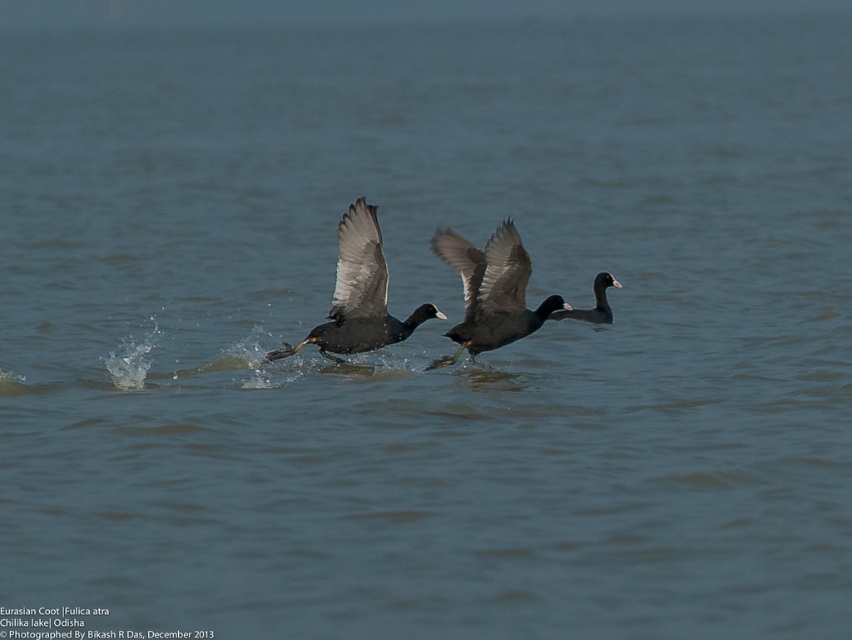
Is dark gray matte eurasian coot at center taller than black glossy eurasian coot at center?

Yes.

Is dark gray matte eurasian coot at center to the right of black glossy eurasian coot at center from the viewer's perspective?

No, dark gray matte eurasian coot at center is not to the right of black glossy eurasian coot at center.

Image resolution: width=852 pixels, height=640 pixels. What do you see at coordinates (491, 291) in the screenshot?
I see `dark gray matte eurasian coot at center` at bounding box center [491, 291].

Find the location of a particular element. dark gray matte eurasian coot at center is located at coordinates (491, 291).

Does dark gray feathers at center have a lesser width compared to black glossy eurasian coot at center?

In fact, dark gray feathers at center might be wider than black glossy eurasian coot at center.

Which is more to the right, dark gray feathers at center or black glossy eurasian coot at center?

black glossy eurasian coot at center

Which is in front, point (350, 298) or point (599, 307)?

Point (350, 298) is in front.

Image resolution: width=852 pixels, height=640 pixels. I want to click on dark gray feathers at center, so click(360, 294).

Can you confirm if dark gray matte eurasian coot at center is thinner than dark gray feathers at center?

Indeed, dark gray matte eurasian coot at center has a lesser width compared to dark gray feathers at center.

Between point (481, 326) and point (386, 342), which one is positioned behind?

The point (386, 342) is behind.

The width and height of the screenshot is (852, 640). Describe the element at coordinates (491, 291) in the screenshot. I see `dark gray matte eurasian coot at center` at that location.

This screenshot has height=640, width=852. What are the coordinates of `dark gray matte eurasian coot at center` in the screenshot? It's located at (491, 291).